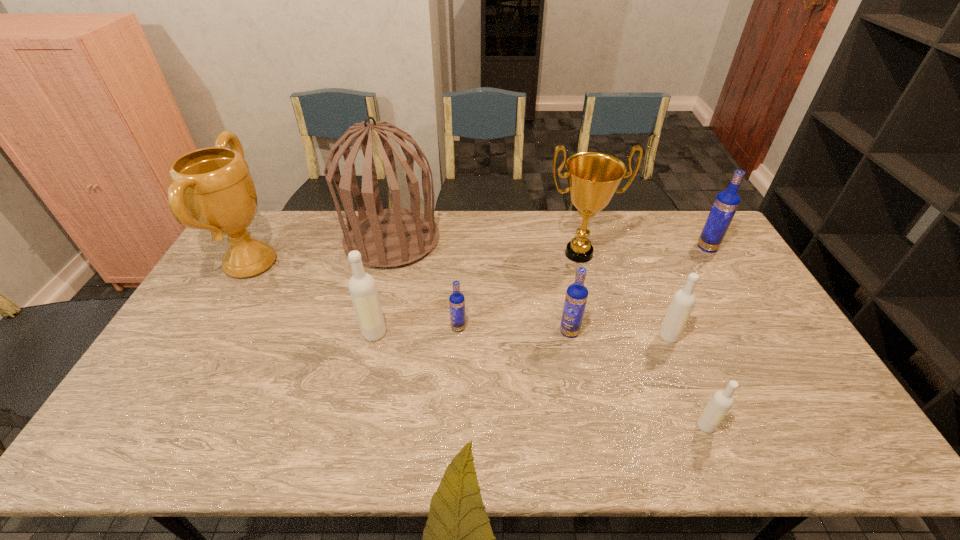
Select which white vodka is the closest to the leftmost object. Please provide its 2D coordinates. Your answer should be formatted as a tuple, i.e. [(x, y)], where the tuple contains the x and y coordinates of a point satisfying the conditions above.

[(362, 287)]

At what (x,y) coordinates should I click in order to perform the action: click on vacant area in the image that satisfies the following two spatial constraints: 1. on the back side of the leftmost white vodka; 2. on the left side of the leftmost blue vodka. Please return your answer as a coordinate pair (x, y). Looking at the image, I should click on (375, 328).

The height and width of the screenshot is (540, 960). I want to click on free space that satisfies the following two spatial constraints: 1. on the back side of the leftmost blue vodka; 2. on the left side of the biggest white vodka, so coord(375,328).

In order to click on free space that satisfies the following two spatial constraints: 1. on the front view with handles of the right award; 2. on the right side of the nearest object in this screenshot , I will do `click(623, 426)`.